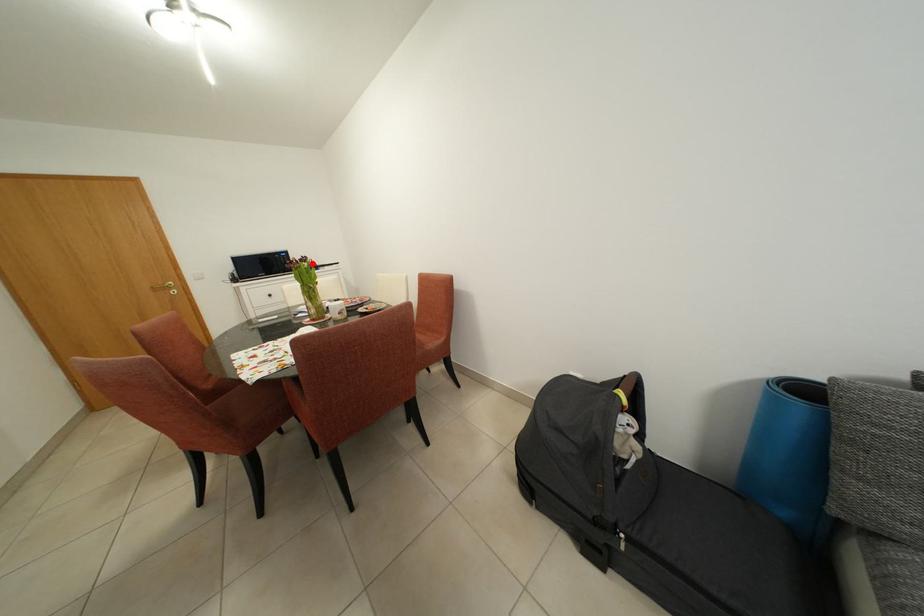
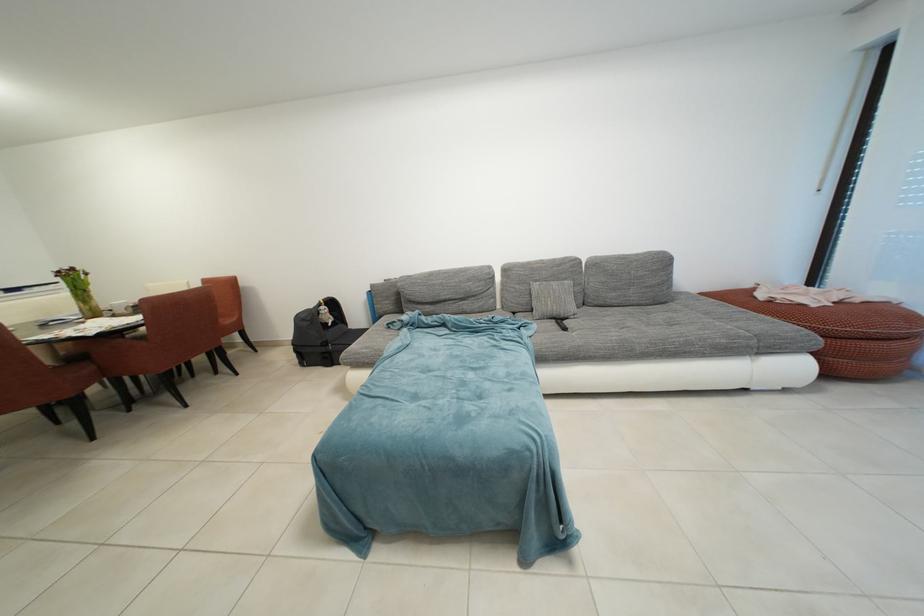
Question: A red point is marked in image1. In image2, is the corresponding 3D point closer to the camera or farther? Reply with the corresponding letter.

Choices:
 (A) The corresponding 3D point is closer.
 (B) The corresponding 3D point is farther.

Answer: (B)